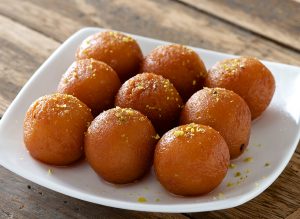
Identify the location of wood surface. pos(28,45).